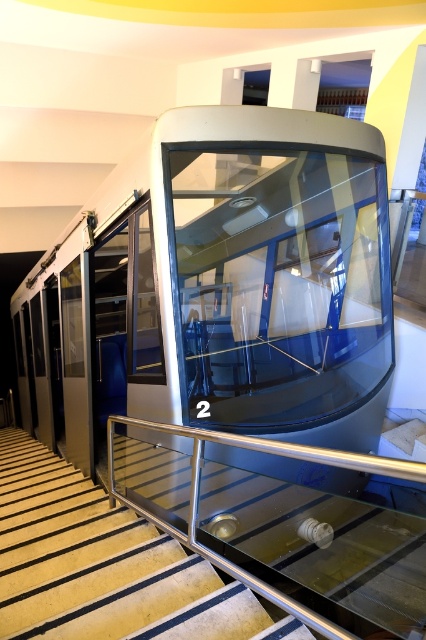
Question: Which object appears farthest from the camera in this image?

Choices:
 (A) transparent glass train at center
 (B) metallic glass stairs at center

Answer: (A)

Question: Which object is farther from the camera taking this photo?

Choices:
 (A) metallic glass stairs at center
 (B) transparent glass train at center

Answer: (B)

Question: Can you confirm if transparent glass train at center is positioned to the right of metallic glass stairs at center?

Choices:
 (A) no
 (B) yes

Answer: (B)

Question: Does transparent glass train at center appear on the right side of metallic glass stairs at center?

Choices:
 (A) yes
 (B) no

Answer: (A)

Question: Does transparent glass train at center have a lesser width compared to metallic glass stairs at center?

Choices:
 (A) yes
 (B) no

Answer: (B)